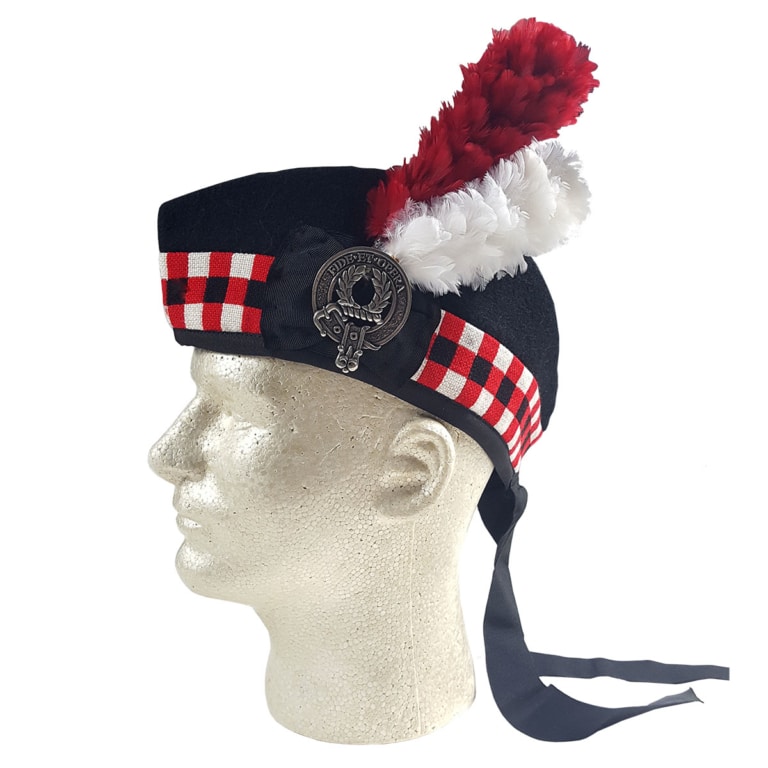
Find the location of a particular element. The image size is (768, 768). foam head is located at coordinates (286, 437).